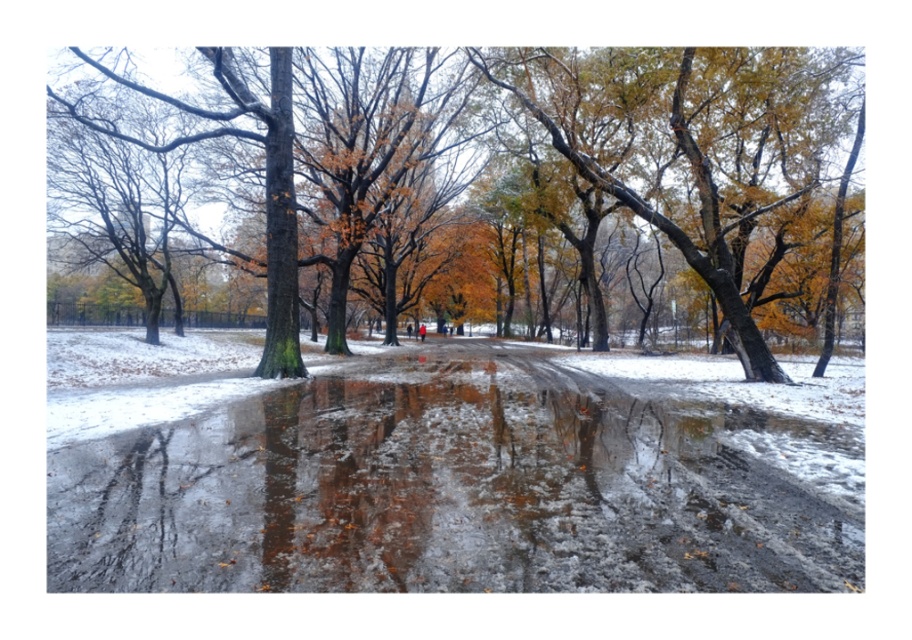
You are standing in the winter scene and want to walk from the point at coordinates point (x=525, y=548) to the point at coordinates point (x=605, y=90). Which direction should you move to get closer to your destination?

To move from point (x=525, y=548) to point 0.141, 0664, you should move towards the left since point (x=525, y=548) is positioned to the right of point (x=605, y=90).